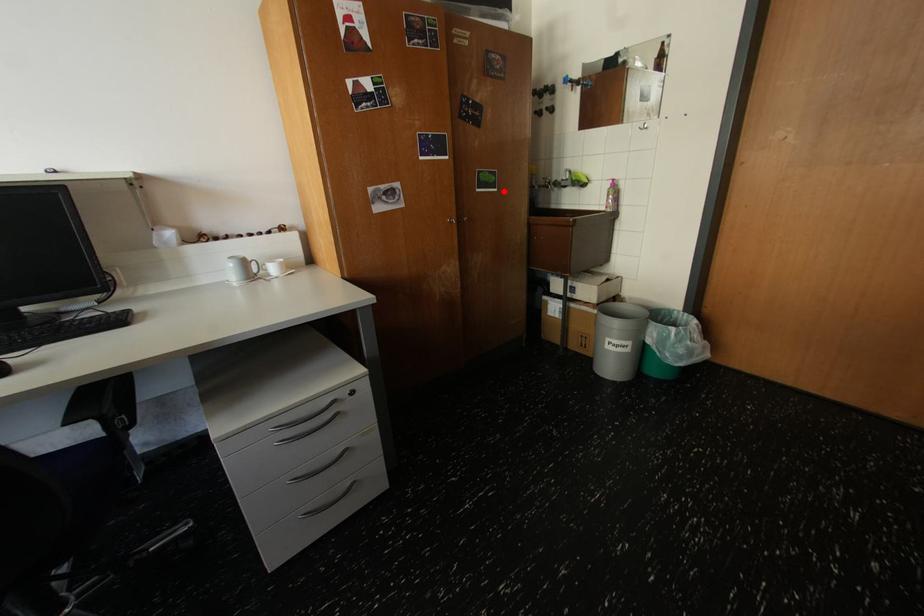
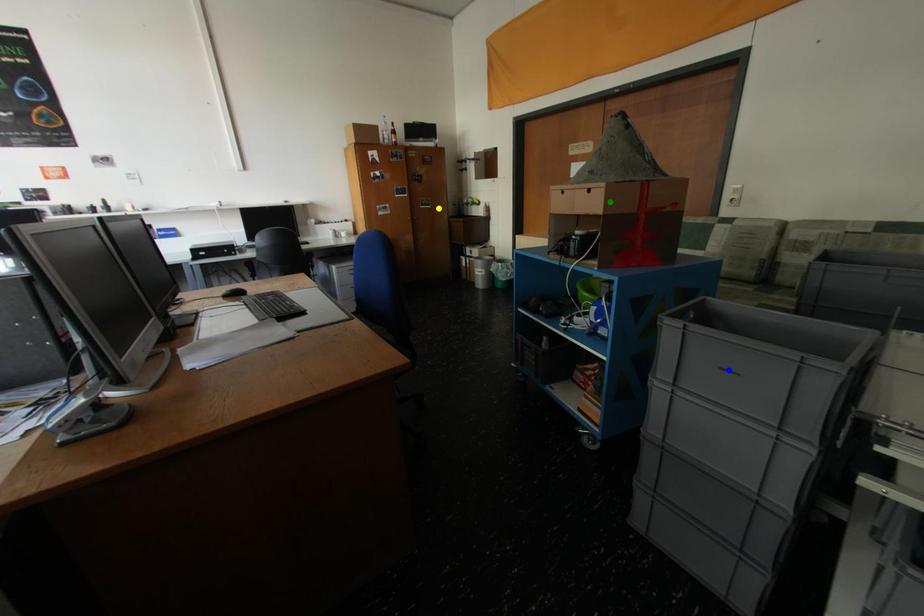
Question: I am providing you with two images of the same scene from different viewpoints. A red point is marked on the first image. You are given multiple points on the second image. Which spot in image 2 lines up with the point in image 1?

Choices:
 (A) green point
 (B) yellow point
 (C) blue point

Answer: (B)